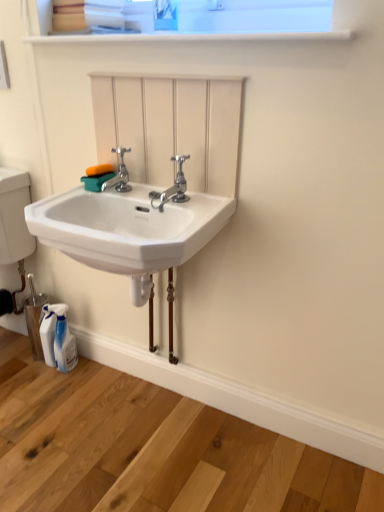
Question: Can you confirm if polished chrome faucet at center, the 2th tap from the left, is positioned to the left of white glossy shelf at upper center?

Choices:
 (A) no
 (B) yes

Answer: (B)

Question: Considering the relative positions of polished chrome faucet at center, the 2th tap from the left, and white glossy shelf at upper center in the image provided, is polished chrome faucet at center, the 2th tap from the left, to the right of white glossy shelf at upper center from the viewer's perspective?

Choices:
 (A) no
 (B) yes

Answer: (A)

Question: Is polished chrome faucet at center, the 2th tap from the left, wider than white glossy shelf at upper center?

Choices:
 (A) no
 (B) yes

Answer: (A)

Question: From a real-world perspective, is polished chrome faucet at center, which is the first tap from right to left, physically below white glossy shelf at upper center?

Choices:
 (A) no
 (B) yes

Answer: (B)

Question: Are polished chrome faucet at center, the 2th tap from the left, and white glossy shelf at upper center located far from each other?

Choices:
 (A) no
 (B) yes

Answer: (A)

Question: Would you say white glossy shelf at upper center is part of polished chrome faucet at center, which is the first tap from right to left,'s contents?

Choices:
 (A) yes
 (B) no

Answer: (B)

Question: Is chrome metallic faucet at center, acting as the first tap starting from the left, to the left of white ceramic sink at center from the viewer's perspective?

Choices:
 (A) yes
 (B) no

Answer: (A)

Question: Is chrome metallic faucet at center, which is the second tap from right to left, positioned with its back to white ceramic sink at center?

Choices:
 (A) no
 (B) yes

Answer: (A)

Question: Is chrome metallic faucet at center, which is the second tap from right to left, aimed at white ceramic sink at center?

Choices:
 (A) yes
 (B) no

Answer: (B)

Question: From the image's perspective, is chrome metallic faucet at center, which is the second tap from right to left, on white ceramic sink at center?

Choices:
 (A) yes
 (B) no

Answer: (A)

Question: Is chrome metallic faucet at center, which is the second tap from right to left, positioned far away from white ceramic sink at center?

Choices:
 (A) yes
 (B) no

Answer: (B)

Question: Can you confirm if chrome metallic faucet at center, which is the second tap from right to left, is wider than white ceramic sink at center?

Choices:
 (A) no
 (B) yes

Answer: (A)

Question: Would you say polished chrome faucet at center, the 2th tap from the left, is outside chrome metallic faucet at center, which is the second tap from right to left?

Choices:
 (A) yes
 (B) no

Answer: (A)